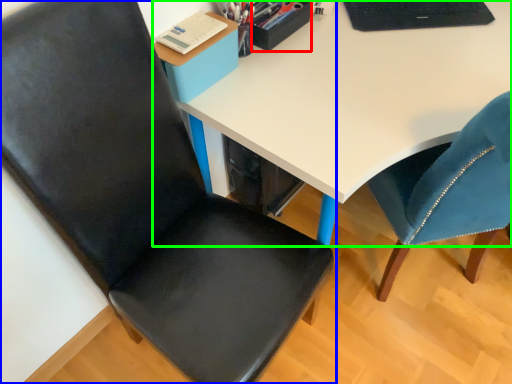
Question: Which object is the closest to the stationery (highlighted by a red box)? Choose among these: chair (highlighted by a blue box) or desk (highlighted by a green box).

Choices:
 (A) chair
 (B) desk

Answer: (B)